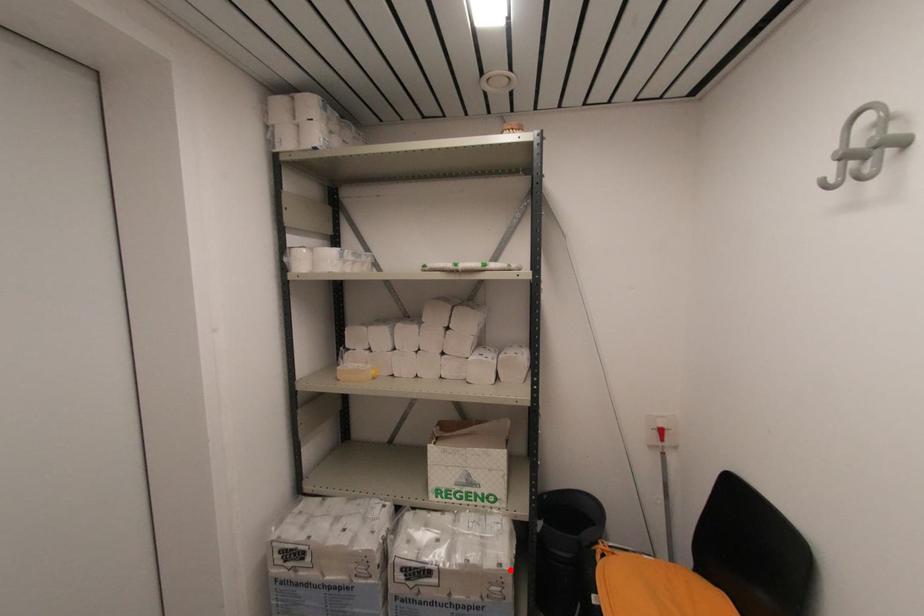
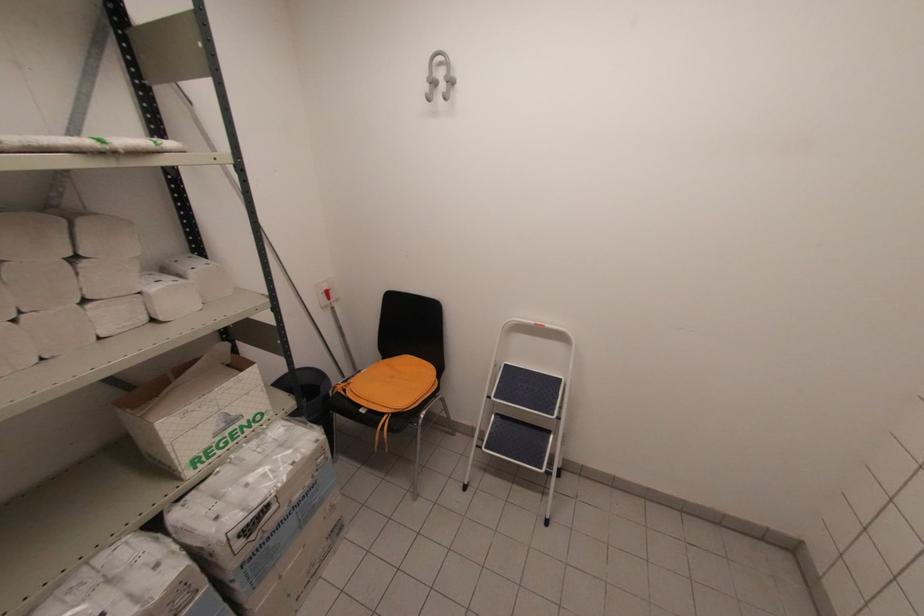
Question: I am providing you with two images of the same scene from different viewpoints. A red point is shown in image1. For the corresponding object point in image2, is it positioned nearer or farther from the camera?

Choices:
 (A) Nearer
 (B) Farther

Answer: (A)